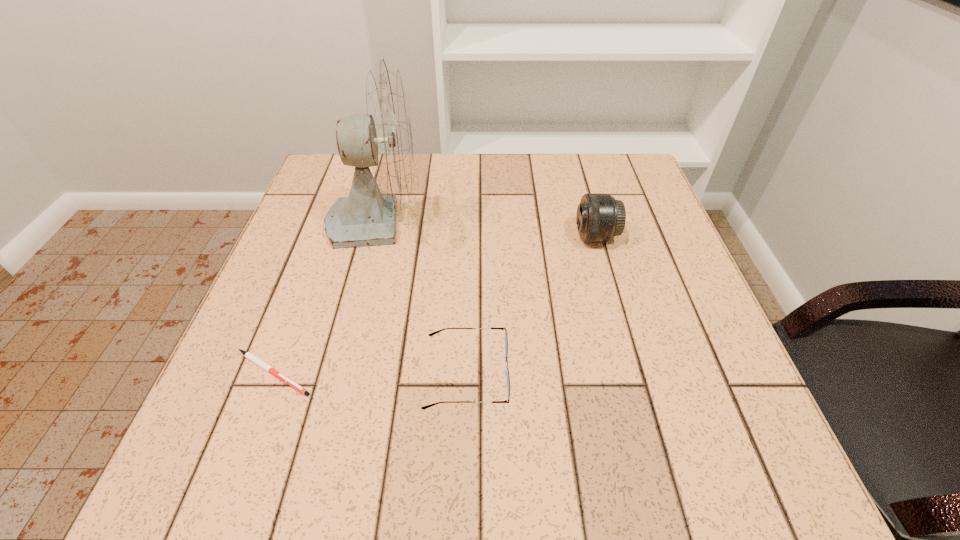
Identify the location of free point located 0.270m on the lenses of the spectacles. This screenshot has height=540, width=960. (665, 374).

The height and width of the screenshot is (540, 960). I want to click on vacant space located 0.240m on the clicker of the shortest object, so click(x=456, y=373).

What are the coordinates of `object that is at the far edge` in the screenshot? It's located at (382, 139).

Locate an element on the screen. fan positioned at the left edge is located at coordinates (382, 139).

At what (x,y) coordinates should I click in order to perform the action: click on pen that is positioned at the left edge. Please return your answer as a coordinate pair (x, y). The height and width of the screenshot is (540, 960). Looking at the image, I should click on (248, 355).

Locate an element on the screen. object that is at the right edge is located at coordinates (600, 217).

Locate an element on the screen. The image size is (960, 540). object present at the far left corner is located at coordinates (382, 139).

Where is `vacant area at the far edge of the desktop`? vacant area at the far edge of the desktop is located at coordinates (493, 194).

Image resolution: width=960 pixels, height=540 pixels. Identify the location of free spot at the near edge of the desktop. (501, 474).

In the image, there is a desktop. Where is `vacant region at the left edge`? The height and width of the screenshot is (540, 960). vacant region at the left edge is located at coordinates (337, 305).